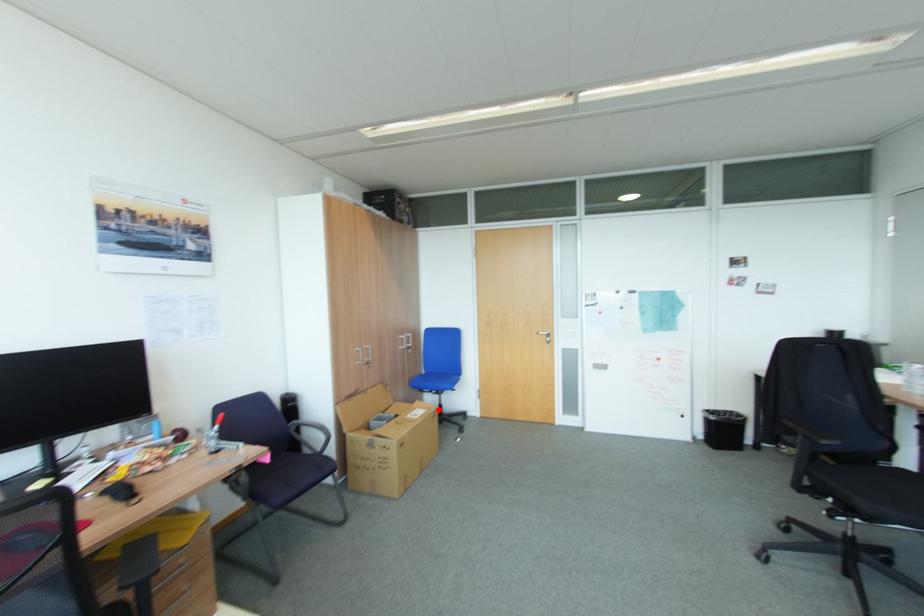
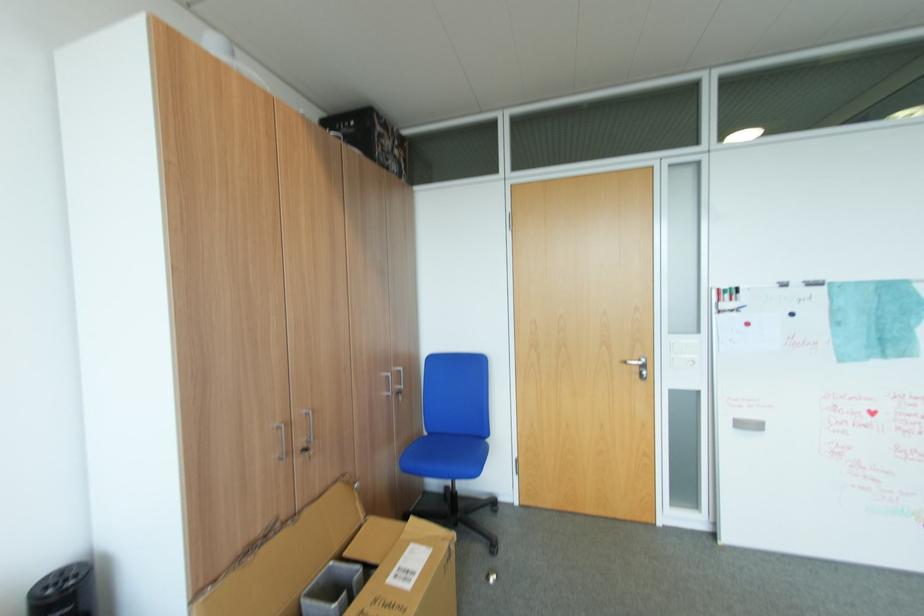
Locate, in the second image, the point that corresponds to the highlighted location in the first image.

(451, 544)